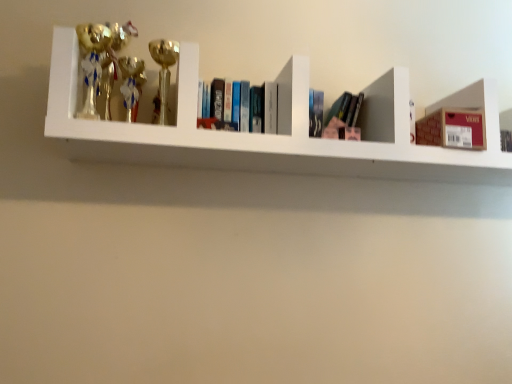
Question: From the image's perspective, is gold shiny trophy at upper left, which is the first toy from right to left, located above gold shiny trophy at left, which ranks as the 2th toy in right-to-left order?

Choices:
 (A) no
 (B) yes

Answer: (A)

Question: Considering the relative sizes of gold shiny trophy at upper left, the second toy viewed from the left, and gold shiny trophy at left, which is the 1th toy in left-to-right order, in the image provided, is gold shiny trophy at upper left, the second toy viewed from the left, wider than gold shiny trophy at left, which is the 1th toy in left-to-right order,?

Choices:
 (A) no
 (B) yes

Answer: (B)

Question: Is gold shiny trophy at upper left, the second toy viewed from the left, at the right side of gold shiny trophy at left, which is the 1th toy in left-to-right order?

Choices:
 (A) yes
 (B) no

Answer: (A)

Question: Considering the relative positions of gold shiny trophy at upper left, the second toy viewed from the left, and gold shiny trophy at left, which is the 1th toy in left-to-right order, in the image provided, is gold shiny trophy at upper left, the second toy viewed from the left, behind gold shiny trophy at left, which is the 1th toy in left-to-right order,?

Choices:
 (A) yes
 (B) no

Answer: (A)

Question: From a real-world perspective, is gold shiny trophy at upper left, which is the first toy from right to left, physically below gold shiny trophy at left, which ranks as the 2th toy in right-to-left order?

Choices:
 (A) no
 (B) yes

Answer: (B)

Question: Is gold shiny trophy at left, which ranks as the 2th toy in right-to-left order, at the back of gold shiny trophy at upper left, the second toy viewed from the left?

Choices:
 (A) yes
 (B) no

Answer: (B)

Question: Is metallic trophies at left at the right side of hardcover books at center?

Choices:
 (A) yes
 (B) no

Answer: (A)

Question: Is the depth of metallic trophies at left greater than that of hardcover books at center?

Choices:
 (A) no
 (B) yes

Answer: (A)

Question: Does metallic trophies at left lie in front of hardcover books at center?

Choices:
 (A) yes
 (B) no

Answer: (A)

Question: Is metallic trophies at left thinner than hardcover books at center?

Choices:
 (A) no
 (B) yes

Answer: (A)

Question: Is metallic trophies at left shorter than hardcover books at center?

Choices:
 (A) no
 (B) yes

Answer: (A)

Question: Considering the relative sizes of metallic trophies at left and hardcover books at center in the image provided, is metallic trophies at left smaller than hardcover books at center?

Choices:
 (A) no
 (B) yes

Answer: (A)

Question: Are hardcover books at center and gold shiny trophy at upper left, which is the first toy from right to left, beside each other?

Choices:
 (A) no
 (B) yes

Answer: (A)